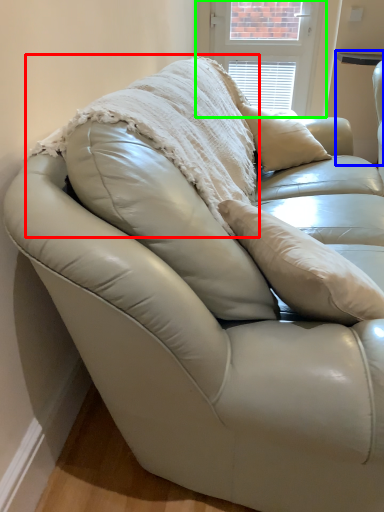
Question: Which is nearer to the blanket (highlighted by a red box)? table (highlighted by a blue box) or window screen (highlighted by a green box).

Choices:
 (A) table
 (B) window screen

Answer: (B)